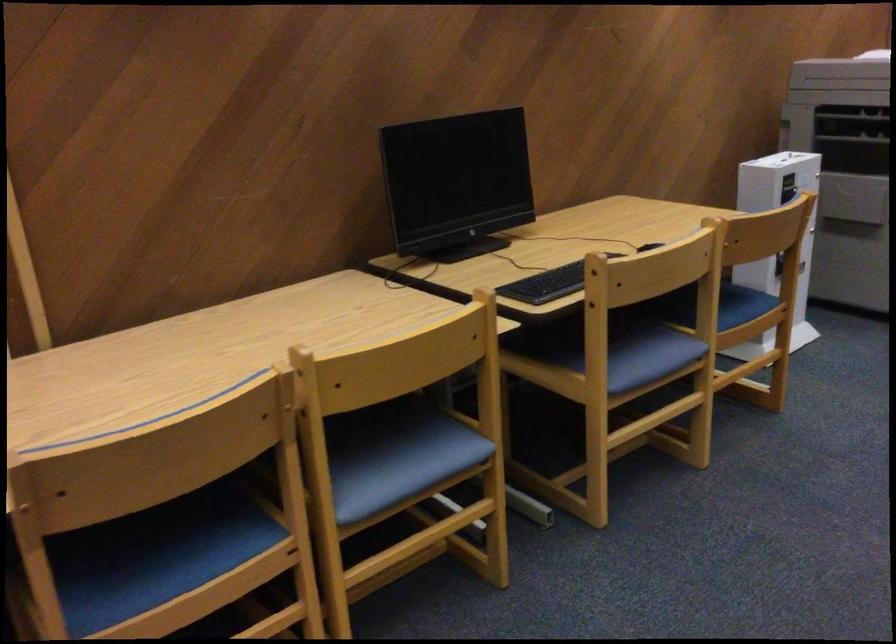
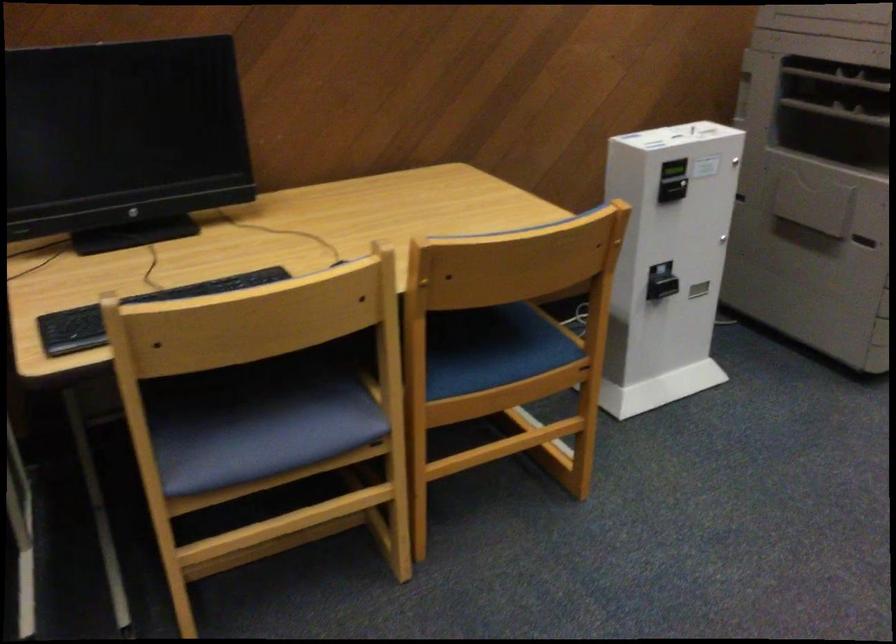
Which direction would the cameraman need to move to produce the second image?

The cameraman moved toward right, forward.